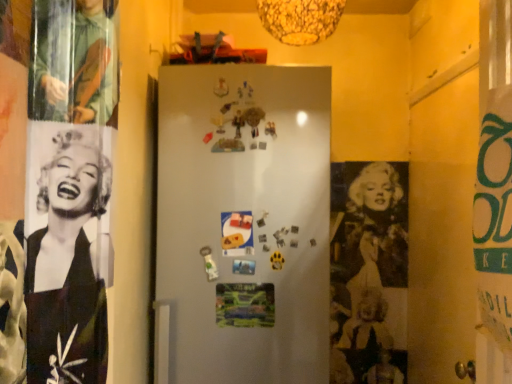
Question: In the image, is metallic silver poster at center, positioned as the first poster page in bottom-to-top order, positioned in front of or behind matte paper poster at center, arranged as the second poster page when ordered from the bottom?

Choices:
 (A) front
 (B) behind

Answer: (B)

Question: Considering the relative positions of metallic silver poster at center, which is the 2th poster page in top-to-bottom order, and matte paper poster at center, arranged as the second poster page when ordered from the bottom, in the image provided, is metallic silver poster at center, which is the 2th poster page in top-to-bottom order, to the left or to the right of matte paper poster at center, arranged as the second poster page when ordered from the bottom,?

Choices:
 (A) left
 (B) right

Answer: (B)

Question: Based on their sizes in the image, would you say metallic silver poster at center, which is the 2th poster page in top-to-bottom order, is bigger or smaller than matte paper poster at center, which is the 1th poster page from top to bottom?

Choices:
 (A) big
 (B) small

Answer: (A)

Question: Considering the positions of matte paper poster at center, arranged as the second poster page when ordered from the bottom, and metallic silver poster at center, positioned as the first poster page in bottom-to-top order, in the image, is matte paper poster at center, arranged as the second poster page when ordered from the bottom, taller or shorter than metallic silver poster at center, positioned as the first poster page in bottom-to-top order,?

Choices:
 (A) tall
 (B) short

Answer: (A)

Question: From a real-world perspective, is matte paper poster at center, arranged as the second poster page when ordered from the bottom, above or below metallic silver poster at center, positioned as the first poster page in bottom-to-top order?

Choices:
 (A) above
 (B) below

Answer: (A)

Question: Is matte paper poster at center, which is the 1th poster page from top to bottom, situated inside metallic silver poster at center, which is the 2th poster page in top-to-bottom order, or outside?

Choices:
 (A) outside
 (B) inside

Answer: (A)

Question: Based on their positions, is matte paper poster at center, which is the 1th poster page from top to bottom, located to the left or right of metallic silver poster at center, which is the 2th poster page in top-to-bottom order?

Choices:
 (A) left
 (B) right

Answer: (A)